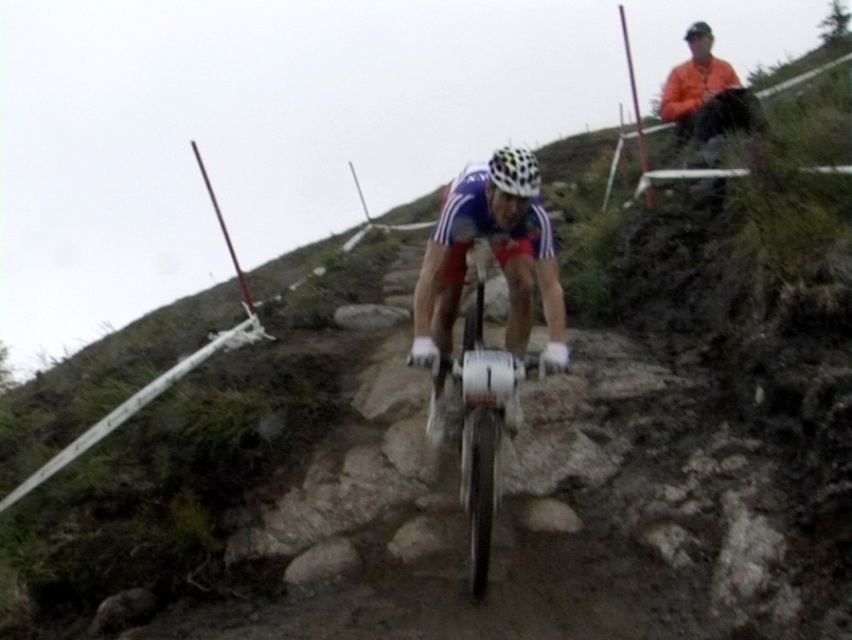
Question: Does shiny metallic bicycle at center have a lesser width compared to multicolored matte bicycle helmet at center?

Choices:
 (A) yes
 (B) no

Answer: (B)

Question: Can you confirm if shiny metallic bicycle at center is positioned to the left of multicolored matte bicycle helmet at center?

Choices:
 (A) no
 (B) yes

Answer: (B)

Question: Is shiny metallic bicycle at center positioned at the back of multicolored matte bicycle helmet at center?

Choices:
 (A) yes
 (B) no

Answer: (B)